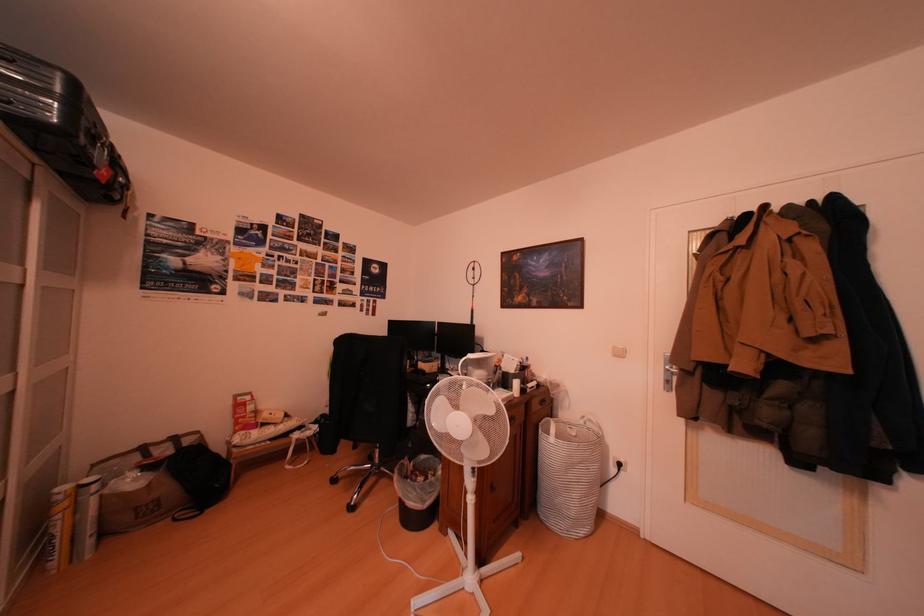
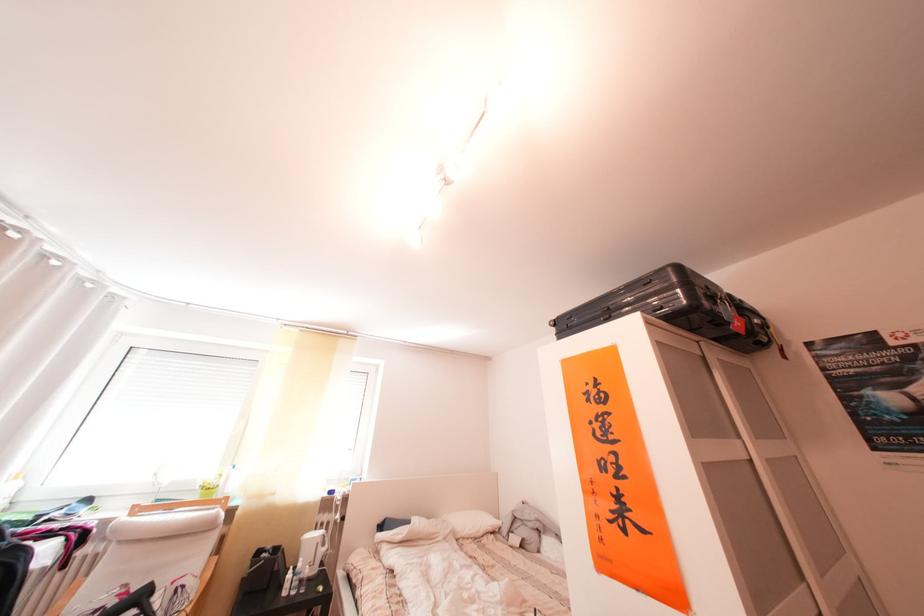
In the second image, find the point that corresponds to [106,172] in the first image.

(742, 329)